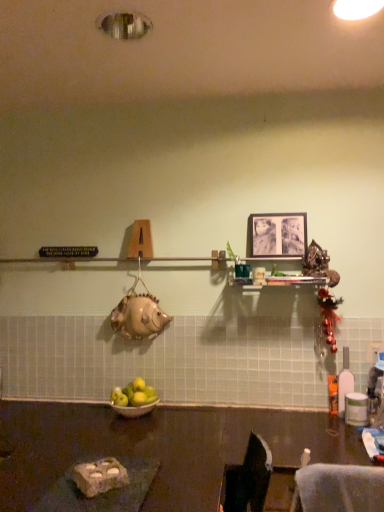
Question: In terms of height, does translucent plastic bottle at right look taller or shorter compared to green matte apples at center?

Choices:
 (A) tall
 (B) short

Answer: (A)

Question: Is translucent plastic bottle at right in front of or behind green matte apples at center in the image?

Choices:
 (A) front
 (B) behind

Answer: (B)

Question: Which of these objects is positioned farthest from the green matte apples at center?

Choices:
 (A) silver metallic bowl at center
 (B) dark brown polished table at lower center
 (C) black matte picture frame at upper center
 (D) translucent plastic bottle at right

Answer: (C)

Question: Which object is positioned farthest from the dark brown polished table at lower center?

Choices:
 (A) black matte picture frame at upper center
 (B) green matte apples at center
 (C) silver metallic bowl at center
 (D) translucent plastic bottle at right

Answer: (A)